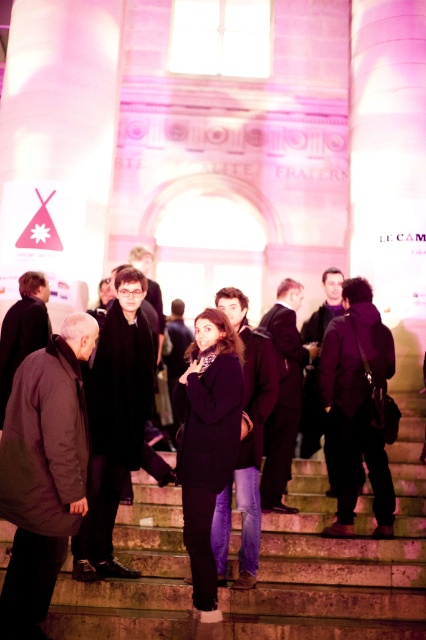
You are standing at the base of the grand structure with the classical columns and arched doorway. You notice a point marked at coordinates (337, 557) in the image. What does this point represent in the scene?

The point at coordinates 0.873, 0.793 corresponds to the stone stairs at center.

You are attending an event at a historical monument and notice two attendees dressed in a dark gray jacket at lower left and a shiny black suit at center. Which attendee is standing closer to the front of the monument?

The dark gray jacket at lower left is positioned under the shiny black suit at center, meaning it is closer to the front of the monument.